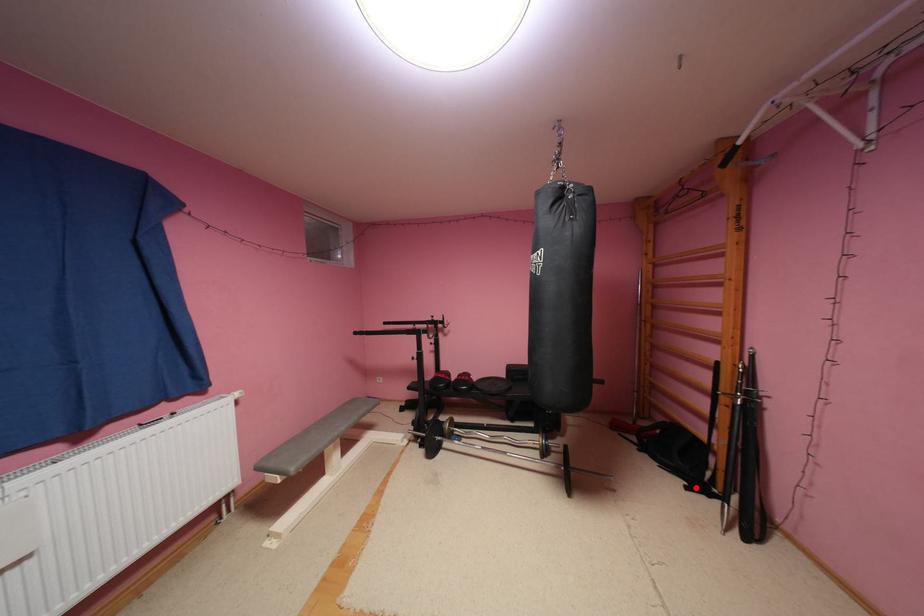
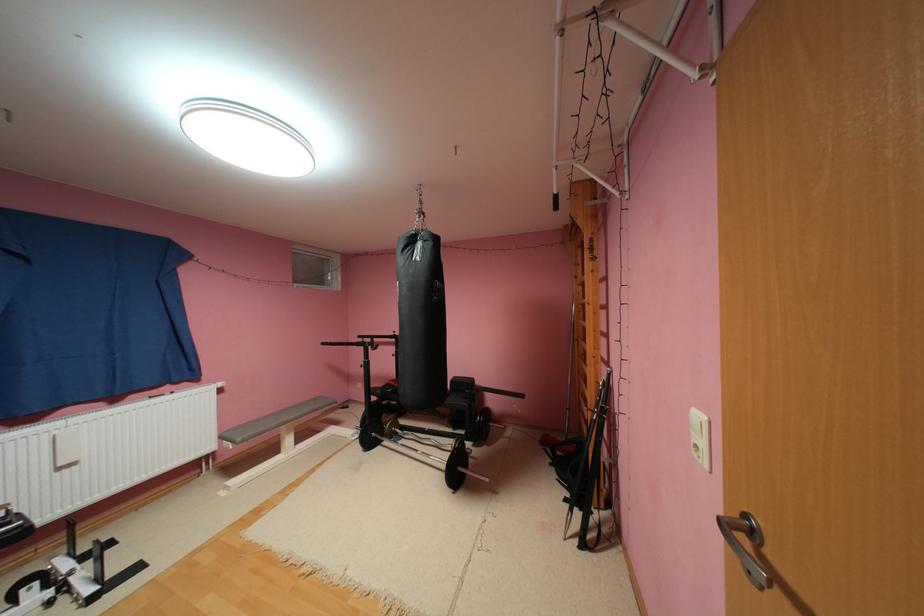
Find the pixel in the second image that matches the highlighted location in the first image.

(575, 500)